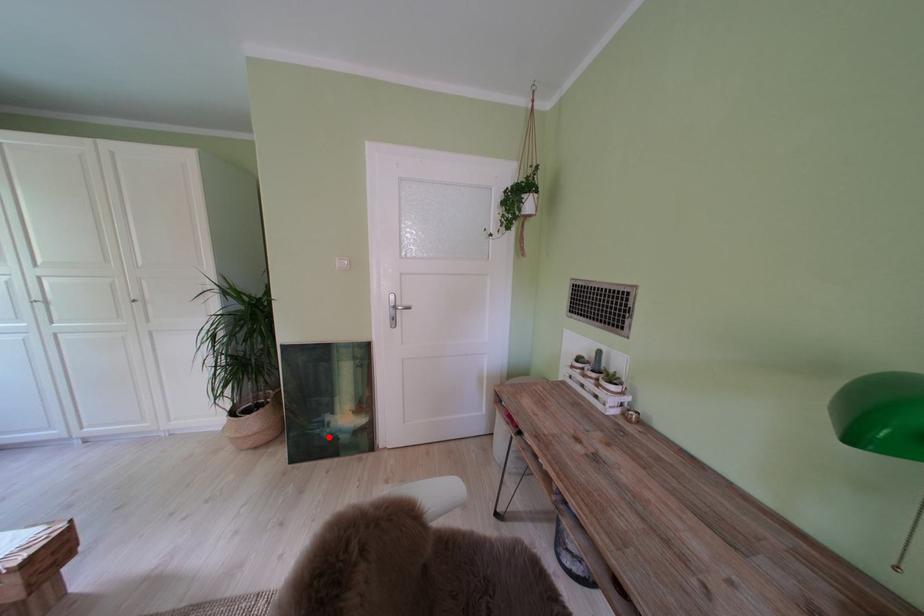
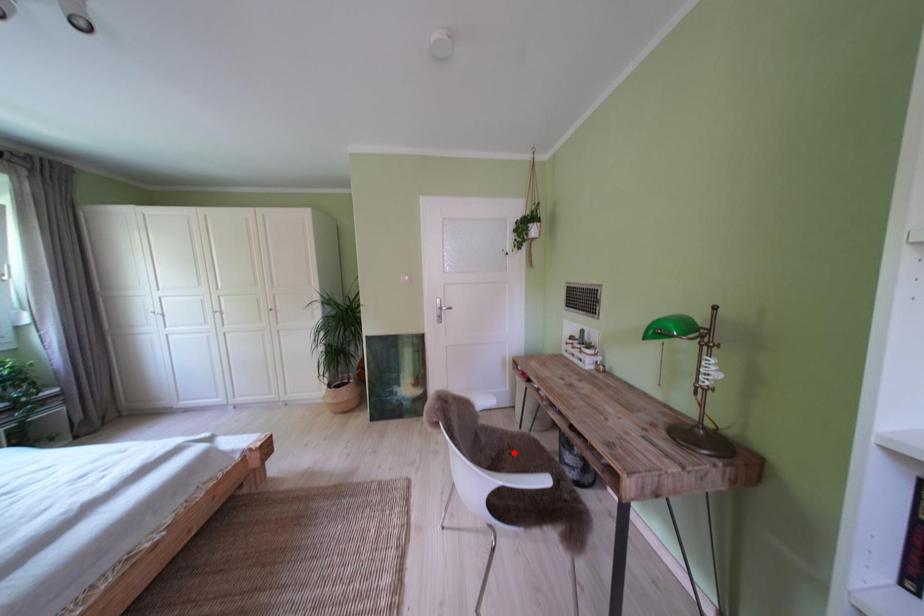
I am providing you with two images of the same scene from different viewpoints. A red point is marked on the first image and another point is marked on the second image. Does the point marked in image1 correspond to the same location as the one in image2?

No